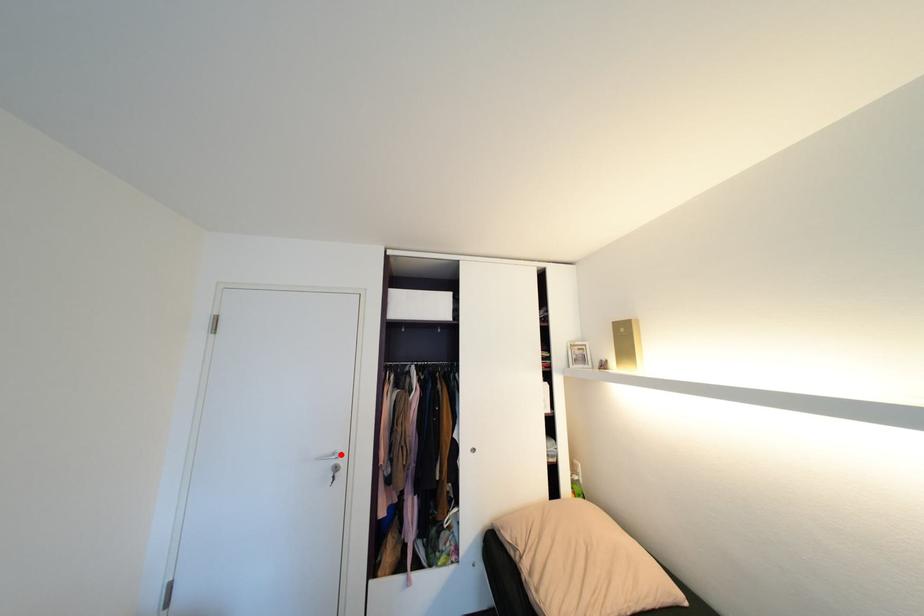
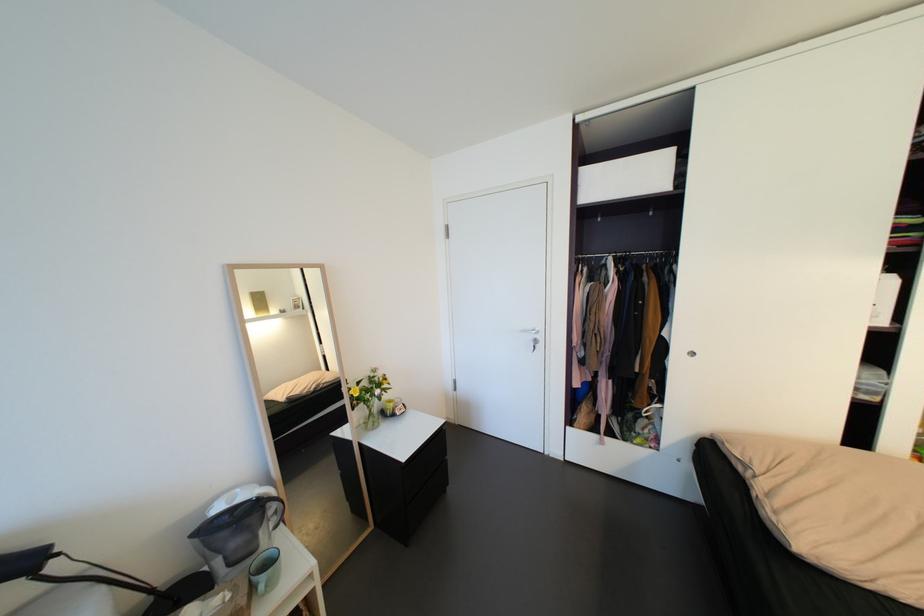
The point at the highlighted location is marked in the first image. Where is the corresponding point in the second image?

(541, 331)